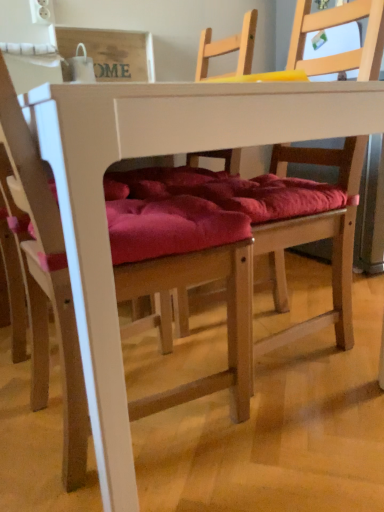
What is the approximate width of white matte table at center?

31.77 inches.

Locate an element on the screen. This screenshot has width=384, height=512. velvet red cushion at center, positioned as the 1th chair in left-to-right order is located at coordinates (187, 279).

What are the coordinates of `white matte table at center` in the screenshot? It's located at (155, 155).

Would you say wooden chair with red cushion at center, which is counted as the first chair, starting from the right, is to the left or to the right of velvet red cushion at center, which is the 2th chair in right-to-left order, in the picture?

wooden chair with red cushion at center, which is counted as the first chair, starting from the right, is to the right of velvet red cushion at center, which is the 2th chair in right-to-left order.

From a real-world perspective, who is located higher, wooden chair with red cushion at center, acting as the second chair starting from the left, or velvet red cushion at center, positioned as the 1th chair in left-to-right order?

velvet red cushion at center, positioned as the 1th chair in left-to-right order.

From the image's perspective, is wooden chair with red cushion at center, which is counted as the first chair, starting from the right, under velvet red cushion at center, positioned as the 1th chair in left-to-right order?

No.

Which object is wider, wooden chair with red cushion at center, acting as the second chair starting from the left, or velvet red cushion at center, which is the 2th chair in right-to-left order?

wooden chair with red cushion at center, acting as the second chair starting from the left, is wider.

From a real-world perspective, is wooden chair with red cushion at center, acting as the second chair starting from the left, positioned above or below white matte table at center?

In terms of real-world spatial position, wooden chair with red cushion at center, acting as the second chair starting from the left, is above white matte table at center.

Does wooden chair with red cushion at center, which is counted as the first chair, starting from the right, have a smaller size compared to white matte table at center?

Yes, wooden chair with red cushion at center, which is counted as the first chair, starting from the right, is smaller than white matte table at center.

Based on the photo, does wooden chair with red cushion at center, which is counted as the first chair, starting from the right, come in front of white matte table at center?

No, wooden chair with red cushion at center, which is counted as the first chair, starting from the right, is further to the viewer.

Is wooden chair with red cushion at center, which is counted as the first chair, starting from the right, facing towards white matte table at center?

Yes, wooden chair with red cushion at center, which is counted as the first chair, starting from the right, is facing white matte table at center.

The width and height of the screenshot is (384, 512). I want to click on table that is on the right side of velvet red cushion at center, which is the 2th chair in right-to-left order, so click(155, 155).

Looking at this image, is velvet red cushion at center, which is the 2th chair in right-to-left order, not within white matte table at center?

No, velvet red cushion at center, which is the 2th chair in right-to-left order, is not entirely external to white matte table at center.

Considering the sizes of velvet red cushion at center, positioned as the 1th chair in left-to-right order, and white matte table at center in the image, is velvet red cushion at center, positioned as the 1th chair in left-to-right order, taller or shorter than white matte table at center?

Clearly, velvet red cushion at center, positioned as the 1th chair in left-to-right order, is taller compared to white matte table at center.

How distant is velvet red cushion at center, which is the 2th chair in right-to-left order, from white matte table at center?

velvet red cushion at center, which is the 2th chair in right-to-left order, and white matte table at center are 6.55 inches apart from each other.

Which is more to the left, white matte table at center or velvet red cushion at center, which is the 2th chair in right-to-left order?

velvet red cushion at center, which is the 2th chair in right-to-left order, is more to the left.

Does white matte table at center turn towards velvet red cushion at center, which is the 2th chair in right-to-left order?

No, white matte table at center is not oriented towards velvet red cushion at center, which is the 2th chair in right-to-left order.

Considering the sizes of objects white matte table at center and velvet red cushion at center, positioned as the 1th chair in left-to-right order, in the image provided, who is wider, white matte table at center or velvet red cushion at center, positioned as the 1th chair in left-to-right order,?

white matte table at center.

Measure the distance between velvet red cushion at center, positioned as the 1th chair in left-to-right order, and wooden chair with red cushion at center, which is counted as the first chair, starting from the right.

17.08 inches.

Does velvet red cushion at center, positioned as the 1th chair in left-to-right order, have a larger size compared to wooden chair with red cushion at center, acting as the second chair starting from the left?

No.

Is velvet red cushion at center, positioned as the 1th chair in left-to-right order, completely or partially outside of wooden chair with red cushion at center, acting as the second chair starting from the left?

That's correct, velvet red cushion at center, positioned as the 1th chair in left-to-right order, is outside of wooden chair with red cushion at center, acting as the second chair starting from the left.

From the image's perspective, is velvet red cushion at center, which is the 2th chair in right-to-left order, on top of wooden chair with red cushion at center, acting as the second chair starting from the left?

Actually, velvet red cushion at center, which is the 2th chair in right-to-left order, appears below wooden chair with red cushion at center, acting as the second chair starting from the left, in the image.

Is white matte table at center far away from wooden chair with red cushion at center, acting as the second chair starting from the left?

No, white matte table at center is in close proximity to wooden chair with red cushion at center, acting as the second chair starting from the left.

Based on the photo, considering the relative sizes of white matte table at center and wooden chair with red cushion at center, which is counted as the first chair, starting from the right, in the image provided, is white matte table at center shorter than wooden chair with red cushion at center, which is counted as the first chair, starting from the right,?

Correct, white matte table at center is not as tall as wooden chair with red cushion at center, which is counted as the first chair, starting from the right.

From a real-world perspective, who is located higher, white matte table at center or wooden chair with red cushion at center, acting as the second chair starting from the left?

In real-world perspective, wooden chair with red cushion at center, acting as the second chair starting from the left, is above.

Is wooden chair with red cushion at center, acting as the second chair starting from the left, completely or partially inside white matte table at center?

Yes, wooden chair with red cushion at center, acting as the second chair starting from the left, is a part of white matte table at center.

I want to click on chair that appears behind the velvet red cushion at center, which is the 2th chair in right-to-left order, so click(334, 26).

You are a GUI agent. You are given a task and a screenshot of the screen. Output one action in this format:
    pyautogui.click(x=<x>, y=<y>)
    Task: Click on the table that appears in front of the wooden chair with red cushion at center, which is counted as the first chair, starting from the right
    This screenshot has width=384, height=512.
    Given the screenshot: What is the action you would take?
    pyautogui.click(x=155, y=155)

Which object lies nearer to the anchor point white matte table at center, wooden chair with red cushion at center, acting as the second chair starting from the left, or velvet red cushion at center, positioned as the 1th chair in left-to-right order?

velvet red cushion at center, positioned as the 1th chair in left-to-right order, lies closer to white matte table at center than the other object.

Which object lies nearer to the anchor point wooden chair with red cushion at center, acting as the second chair starting from the left, white matte table at center or velvet red cushion at center, positioned as the 1th chair in left-to-right order?

velvet red cushion at center, positioned as the 1th chair in left-to-right order, is positioned closer to the anchor wooden chair with red cushion at center, acting as the second chair starting from the left.

Which object lies nearer to the anchor point wooden chair with red cushion at center, acting as the second chair starting from the left, velvet red cushion at center, which is the 2th chair in right-to-left order, or white matte table at center?

The object closer to wooden chair with red cushion at center, acting as the second chair starting from the left, is velvet red cushion at center, which is the 2th chair in right-to-left order.

Considering their positions, is wooden chair with red cushion at center, acting as the second chair starting from the left, positioned further to velvet red cushion at center, positioned as the 1th chair in left-to-right order, than white matte table at center?

wooden chair with red cushion at center, acting as the second chair starting from the left.

Based on the photo, when comparing their distances from white matte table at center, does velvet red cushion at center, positioned as the 1th chair in left-to-right order, or wooden chair with red cushion at center, acting as the second chair starting from the left, seem further?

wooden chair with red cushion at center, acting as the second chair starting from the left.

Based on their spatial positions, is white matte table at center or wooden chair with red cushion at center, acting as the second chair starting from the left, closer to velvet red cushion at center, which is the 2th chair in right-to-left order?

white matte table at center.

The width and height of the screenshot is (384, 512). What are the coordinates of `table situated between velvet red cushion at center, positioned as the 1th chair in left-to-right order, and wooden chair with red cushion at center, which is counted as the first chair, starting from the right, from left to right` in the screenshot? It's located at (155, 155).